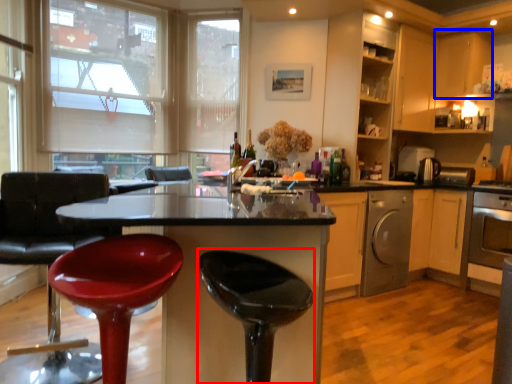
Question: Among these objects, which one is nearest to the camera, bar stool (highlighted by a red box) or cabinetry (highlighted by a blue box)?

Choices:
 (A) bar stool
 (B) cabinetry

Answer: (A)